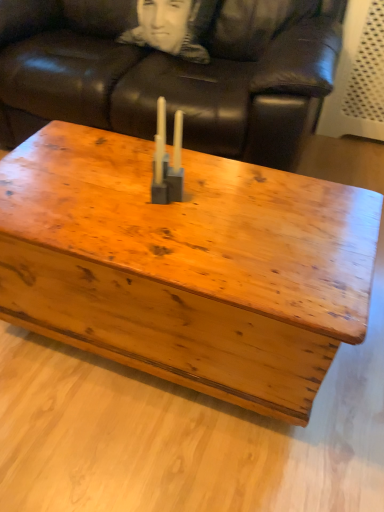
Question: From a real-world perspective, is black fabric pillow at upper center located beneath matte gray plastic candle holder at center?

Choices:
 (A) no
 (B) yes

Answer: (B)

Question: Does black fabric pillow at upper center turn towards matte gray plastic candle holder at center?

Choices:
 (A) no
 (B) yes

Answer: (B)

Question: Is black fabric pillow at upper center further to camera compared to matte gray plastic candle holder at center?

Choices:
 (A) no
 (B) yes

Answer: (B)

Question: Can you confirm if black fabric pillow at upper center is positioned to the left of matte gray plastic candle holder at center?

Choices:
 (A) yes
 (B) no

Answer: (A)

Question: Is matte gray plastic candle holder at center at the back of black fabric pillow at upper center?

Choices:
 (A) no
 (B) yes

Answer: (A)

Question: Does black fabric pillow at upper center lie in front of matte gray plastic candle holder at center?

Choices:
 (A) no
 (B) yes

Answer: (A)

Question: Does brown leather couch at upper center appear on the right side of wooden coffee table at center?

Choices:
 (A) yes
 (B) no

Answer: (B)

Question: Considering the relative sizes of brown leather couch at upper center and wooden coffee table at center in the image provided, is brown leather couch at upper center taller than wooden coffee table at center?

Choices:
 (A) no
 (B) yes

Answer: (B)

Question: Can you confirm if brown leather couch at upper center is positioned to the left of wooden coffee table at center?

Choices:
 (A) yes
 (B) no

Answer: (A)

Question: Is wooden coffee table at center completely or partially inside brown leather couch at upper center?

Choices:
 (A) no
 (B) yes

Answer: (A)

Question: Considering the relative sizes of brown leather couch at upper center and wooden coffee table at center in the image provided, is brown leather couch at upper center wider than wooden coffee table at center?

Choices:
 (A) yes
 (B) no

Answer: (A)

Question: Is brown leather couch at upper center bigger than wooden coffee table at center?

Choices:
 (A) no
 (B) yes

Answer: (B)

Question: Is brown leather couch at upper center positioned in front of matte gray plastic candle holder at center?

Choices:
 (A) no
 (B) yes

Answer: (A)